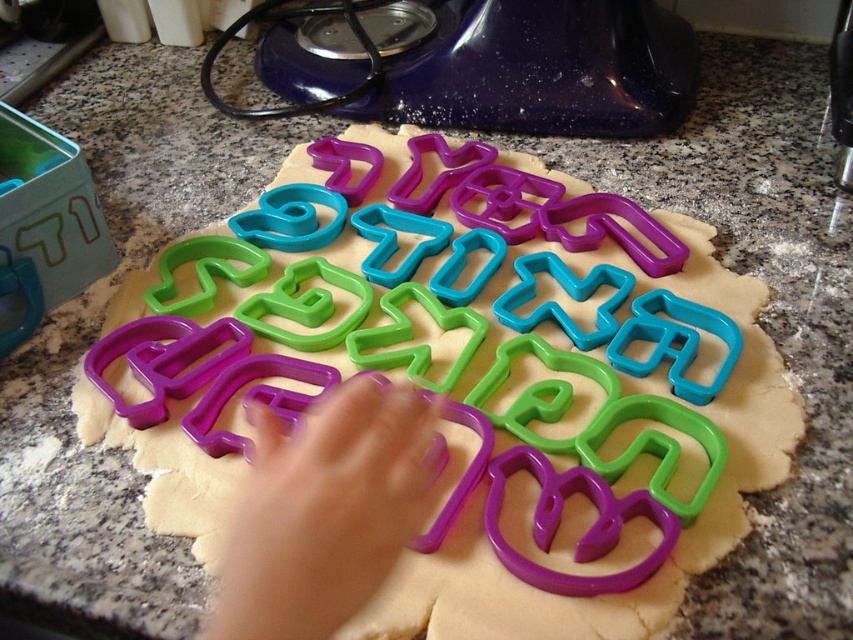
Question: Does purple plastic cookie cutters at center have a smaller size compared to purple plastic hand at center?

Choices:
 (A) no
 (B) yes

Answer: (A)

Question: Considering the relative positions of purple plastic cookie cutters at center and purple plastic hand at center in the image provided, where is purple plastic cookie cutters at center located with respect to purple plastic hand at center?

Choices:
 (A) right
 (B) left

Answer: (A)

Question: Which point is farther from the camera taking this photo?

Choices:
 (A) (489, 269)
 (B) (287, 536)

Answer: (A)

Question: Which point is farther to the camera?

Choices:
 (A) purple plastic hand at center
 (B) purple plastic cookie cutters at center

Answer: (B)

Question: Which point is farther to the camera?

Choices:
 (A) purple plastic hand at center
 (B) purple plastic cookie cutters at center

Answer: (B)

Question: Can you confirm if purple plastic cookie cutters at center is positioned to the right of purple plastic hand at center?

Choices:
 (A) yes
 (B) no

Answer: (A)